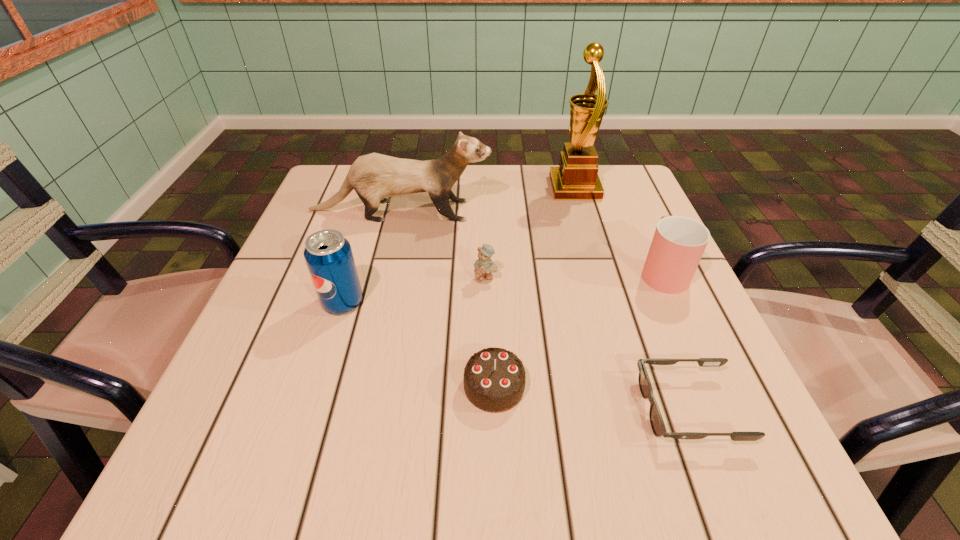
This screenshot has width=960, height=540. I want to click on vacant space situated on the face of the ferret, so click(516, 211).

This screenshot has height=540, width=960. What are the coordinates of `vacant area located 0.080m on the left of the third tallest object` in the screenshot? It's located at [x=280, y=302].

Where is `vacant space located on the side of the cup with the handle`? The image size is (960, 540). vacant space located on the side of the cup with the handle is located at coordinates (623, 183).

Find the location of a particular element. The height and width of the screenshot is (540, 960). vacant area situated 0.330m on the side of the cup with the handle is located at coordinates (618, 173).

Image resolution: width=960 pixels, height=540 pixels. In order to click on free space located on the side of the cup with the handle in this screenshot , I will do `click(626, 191)`.

This screenshot has height=540, width=960. Identify the location of free space located 0.310m on the front-facing side of the teddy bear. (488, 430).

You are a GUI agent. You are given a task and a screenshot of the screen. Output one action in this format:
    pyautogui.click(x=<x>, y=<y>)
    Task: Click on the vacant space positioned on the back of the chocolate cake
    
    Given the screenshot: What is the action you would take?
    pyautogui.click(x=492, y=270)

You are a GUI agent. You are given a task and a screenshot of the screen. Output one action in this format:
    pyautogui.click(x=<x>, y=<y>)
    Task: Click on the free spot located on the temples of the sunglasses
    
    Given the screenshot: What is the action you would take?
    pyautogui.click(x=448, y=408)

I want to click on free space located 0.350m on the temples of the sunglasses, so click(416, 408).

Where is `free spot located on the temples of the sunglasses`? The image size is (960, 540). free spot located on the temples of the sunglasses is located at coordinates (493, 408).